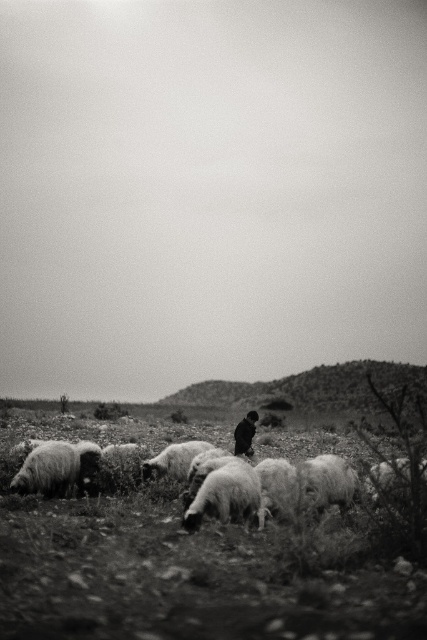
You are a photographer trying to capture the fuzzy woolly sheep at center in your shot. Based on their position in the scene, where should you aim your camera?

The fuzzy woolly sheep at center is located at point (222, 492), so you should aim your camera at those coordinates to capture them in the frame.

You are a photographer trying to capture a clear image of the fuzzy woolly sheep at center and the fluffy white sheep at lower left. Which sheep is located higher in the image?

The fuzzy woolly sheep at center is positioned over the fluffy white sheep at lower left, so it is higher in the image.

In the black and white photo, you see fuzzy woolly sheep at center and a dark fur coat at center. Which object is positioned to the left?

The fuzzy woolly sheep at center is to the left of the dark fur coat at center.